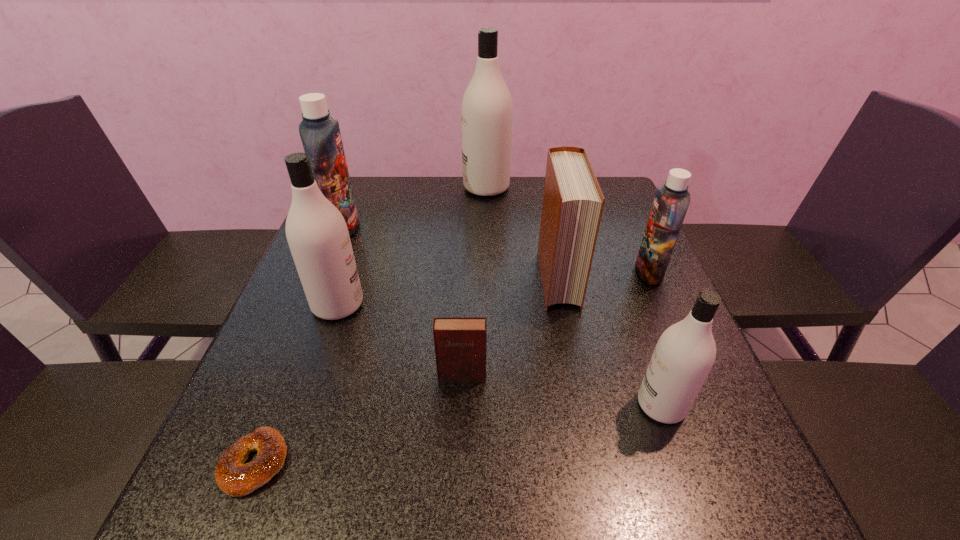
Find the location of a particular element. vacant space that is in between the diary and the third object from right to left is located at coordinates (510, 327).

Identify the location of empty space between the bagel and the third object from right to left. The image size is (960, 540). (406, 371).

Locate an element on the screen. free space that is in between the third object from right to left and the tallest object is located at coordinates tap(522, 233).

This screenshot has width=960, height=540. I want to click on empty space between the reddish-brown diary and the second white shampoo from left to right, so click(x=474, y=281).

This screenshot has width=960, height=540. Identify the location of vacant space that is in between the second nearest white shampoo and the right blue shampoo. (493, 288).

What are the coordinates of `empty location between the nearest white shampoo and the second farthest object` in the screenshot? It's located at (502, 316).

Identify the location of free space between the seventh nearest object and the diary. (402, 301).

Locate which object is the sixth closest to the biggest white shampoo. Please provide its 2D coordinates. Your answer should be formatted as a tuple, i.e. [(x, y)], where the tuple contains the x and y coordinates of a point satisfying the conditions above.

[(685, 352)]

Locate which object is the seventh closest to the diary. Please provide its 2D coordinates. Your answer should be formatted as a tuple, i.e. [(x, y)], where the tuple contains the x and y coordinates of a point satisfying the conditions above.

[(487, 109)]

The width and height of the screenshot is (960, 540). Find the location of `shampoo that stands as the closest to the farthest white shampoo`. shampoo that stands as the closest to the farthest white shampoo is located at coordinates (320, 134).